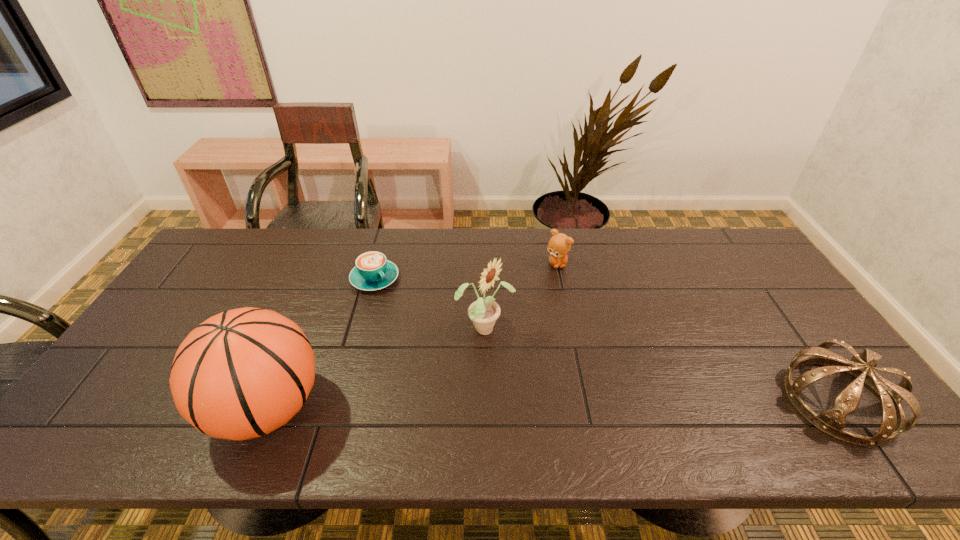
You are a GUI agent. You are given a task and a screenshot of the screen. Output one action in this format:
    pyautogui.click(x=<x>, y=<y>)
    Task: Click on the cappuccino present at the far edge
    
    Given the screenshot: What is the action you would take?
    pyautogui.click(x=373, y=271)

Locate an element on the screen. basketball that is positioned at the near edge is located at coordinates (243, 373).

In order to click on tiara that is at the near edge in this screenshot , I will do `click(832, 421)`.

Identify the location of object positioned at the right edge. This screenshot has width=960, height=540. (832, 421).

At what (x,y) coordinates should I click in order to perform the action: click on object that is at the near right corner. Please return your answer as a coordinate pair (x, y). The image size is (960, 540). Looking at the image, I should click on (832, 421).

Where is `free space at the far edge`? This screenshot has height=540, width=960. free space at the far edge is located at coordinates (488, 229).

Locate an element on the screen. The width and height of the screenshot is (960, 540). vacant space at the near edge of the desktop is located at coordinates (166, 413).

Find the location of a particular element. This screenshot has width=960, height=540. vacant space at the right edge of the desktop is located at coordinates (802, 346).

You are a GUI agent. You are given a task and a screenshot of the screen. Output one action in this format:
    pyautogui.click(x=<x>, y=<y>)
    Task: Click on the vacant space at the far right corner
    This screenshot has width=960, height=540.
    Given the screenshot: What is the action you would take?
    pyautogui.click(x=707, y=248)

Locate an element on the screen. The width and height of the screenshot is (960, 540). unoccupied position between the second shortest object and the cappuccino is located at coordinates (466, 271).